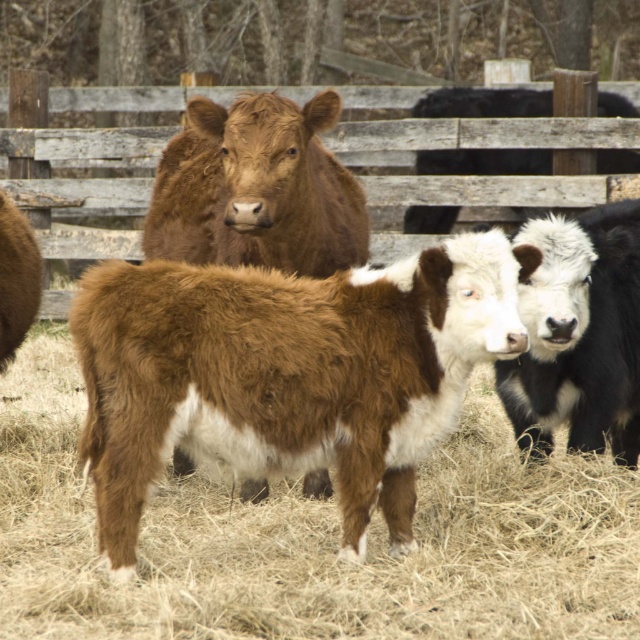
Question: Can you confirm if brown woolly calf at center is thinner than black smooth cow at center?

Choices:
 (A) no
 (B) yes

Answer: (A)

Question: Is black smooth cow at center bigger than black woolly bull at upper right?

Choices:
 (A) no
 (B) yes

Answer: (B)

Question: Which is farther from the black smooth cow at center?

Choices:
 (A) black woolly bull at upper right
 (B) brown woolly calf at center

Answer: (A)

Question: Observing the image, what is the correct spatial positioning of brown woolly calf at center in reference to black woolly bull at upper right?

Choices:
 (A) right
 (B) left

Answer: (B)

Question: Among these points, which one is farthest from the camera?

Choices:
 (A) (557, 564)
 (B) (579, 243)

Answer: (B)

Question: Which object is farther from the camera taking this photo?

Choices:
 (A) black smooth cow at center
 (B) black woolly bull at upper right
 (C) brown woolly calf at center

Answer: (B)